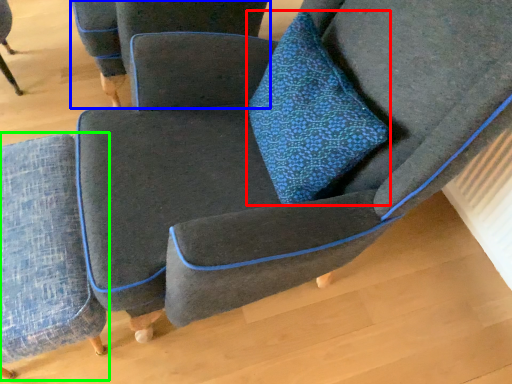
Question: Which is nearer to the throw pillow (highlighted by a red box)? chair (highlighted by a blue box) or chair (highlighted by a green box).

Choices:
 (A) chair
 (B) chair

Answer: (B)